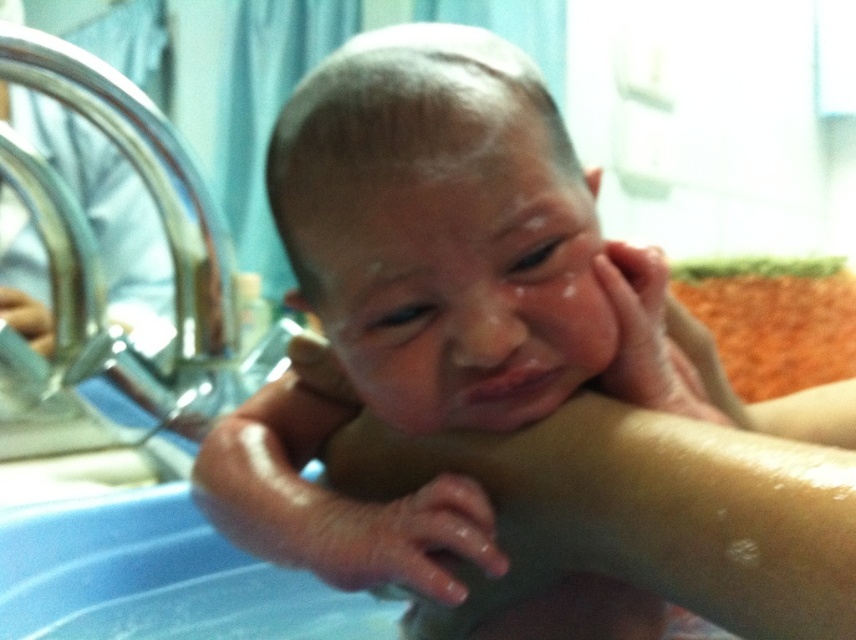
Question: In this image, where is slightly wet skin hand at lower center located relative to dry skin hand at center?

Choices:
 (A) left
 (B) right

Answer: (A)

Question: Is the position of slightly wet skin hand at lower center less distant than that of metallic faucet at upper left?

Choices:
 (A) no
 (B) yes

Answer: (B)

Question: Where is chrome metallic faucet at left located in relation to dry skin hand at center in the image?

Choices:
 (A) left
 (B) right

Answer: (A)

Question: Which of the following is the closest to the observer?

Choices:
 (A) (690, 365)
 (B) (238, 381)

Answer: (A)

Question: Which object appears closest to the camera in this image?

Choices:
 (A) dry skin hand at center
 (B) chrome metallic faucet at left

Answer: (A)

Question: Which point appears closest to the camera in this image?

Choices:
 (A) (195, 356)
 (B) (639, 310)

Answer: (B)